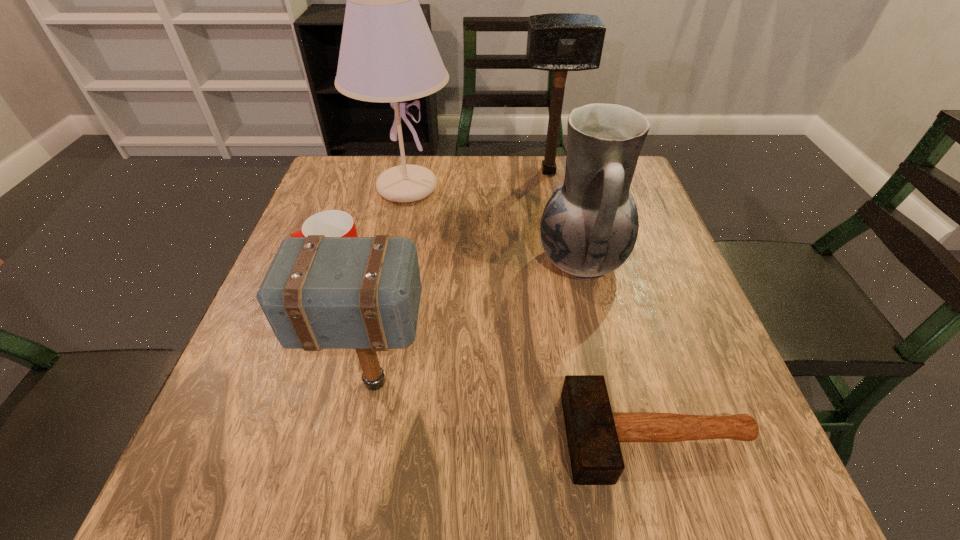
Select which object appears as the closest to the lampshade. Please provide its 2D coordinates. Your answer should be formatted as a tuple, i.e. [(x, y)], where the tuple contains the x and y coordinates of a point satisfying the conditions above.

[(332, 223)]

This screenshot has width=960, height=540. In order to click on object that can be found as the fourth closest to the tallest mallet in this screenshot , I will do `click(363, 293)`.

At what (x,y) coordinates should I click in order to perform the action: click on mallet that stands as the third closest to the lampshade. Please return your answer as a coordinate pair (x, y). This screenshot has width=960, height=540. Looking at the image, I should click on (593, 432).

This screenshot has height=540, width=960. Find the location of `mallet that can be found as the third closest to the tallest object`. mallet that can be found as the third closest to the tallest object is located at coordinates (593, 432).

This screenshot has width=960, height=540. I want to click on free space in the image that satisfies the following two spatial constraints: 1. on the side of the fifth tallest object with the handle; 2. on the back side of the farthest mallet, so pos(367,171).

The image size is (960, 540). Identify the location of vacant space that satisfies the following two spatial constraints: 1. on the side of the second shortest object with the handle; 2. on the right side of the tallest mallet. (367, 171).

Locate an element on the screen. The width and height of the screenshot is (960, 540). vacant point that satisfies the following two spatial constraints: 1. on the side of the cup with the handle; 2. on the right side of the lampshade is located at coordinates (361, 187).